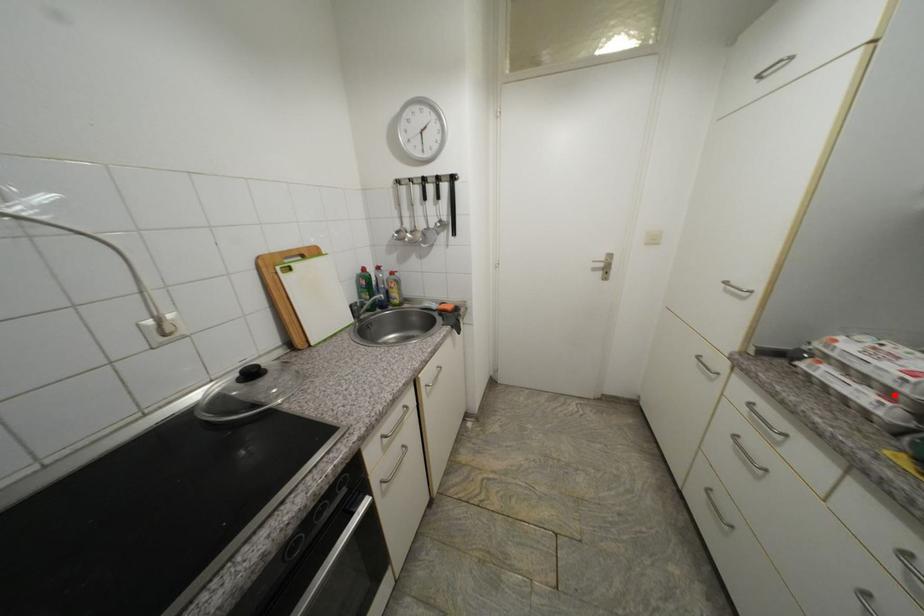
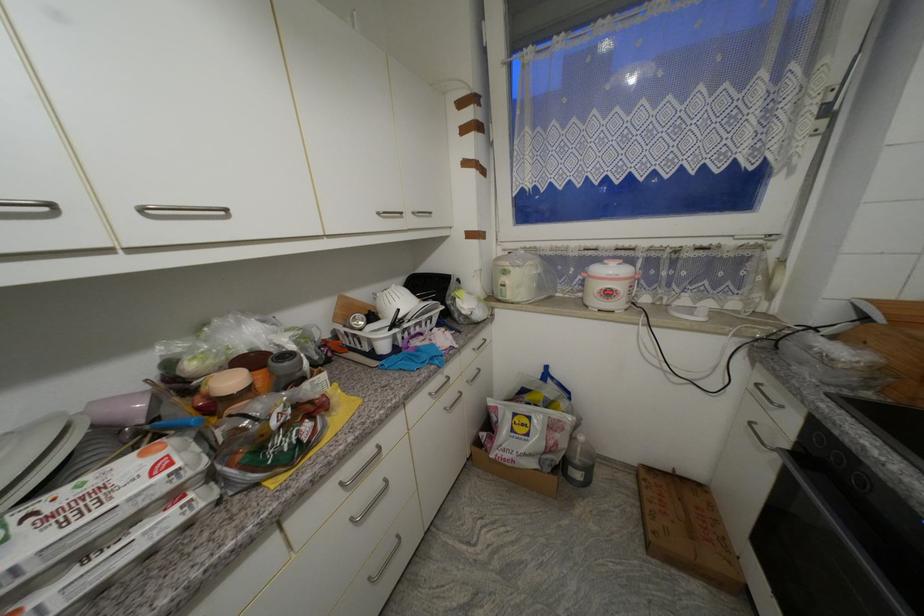
Find the pixel in the second image that matches the highlighted location in the first image.

(178, 498)